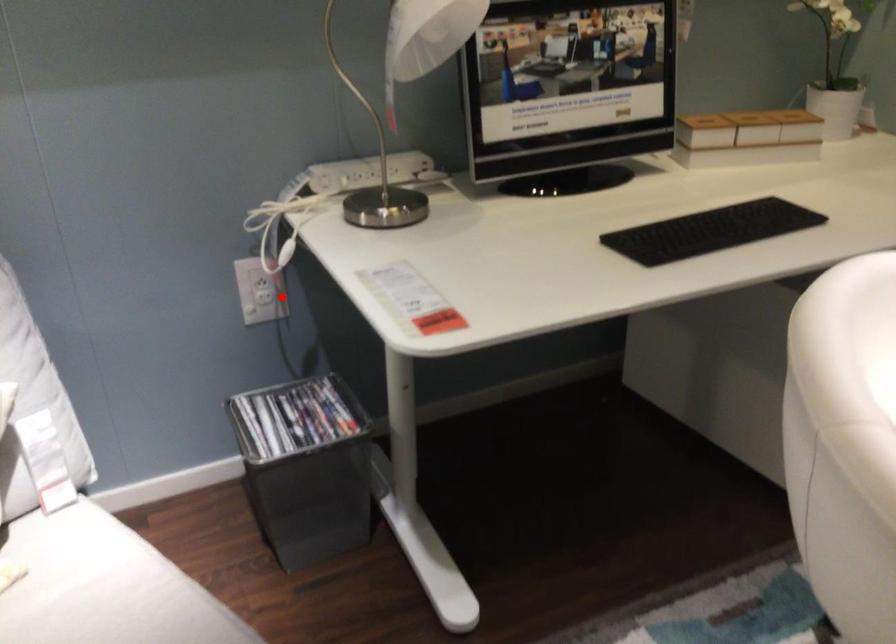
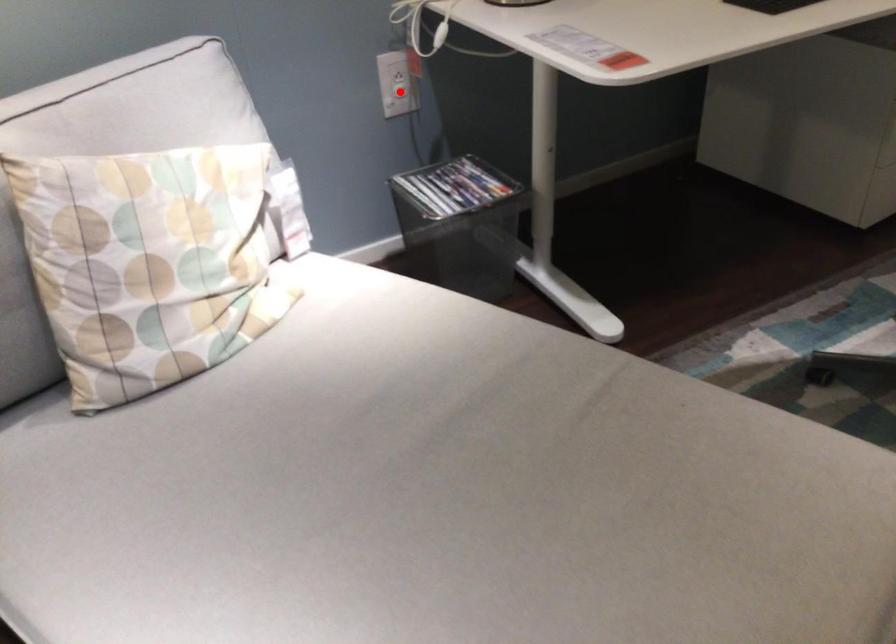
I am providing you with two images of the same scene from different viewpoints. A red point is marked on the first image and another point is marked on the second image. Is the marked point in image1 the same physical position as the marked point in image2?

Yes